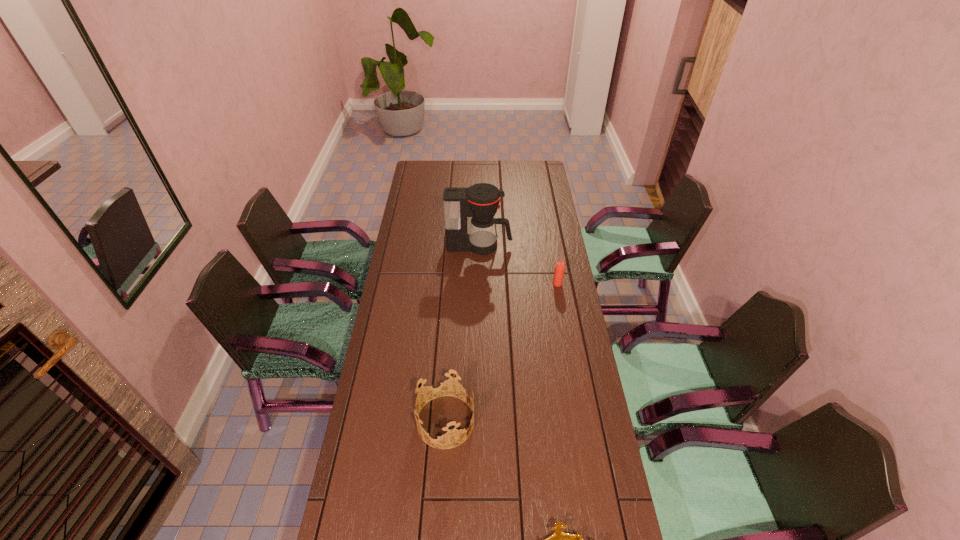
You are a GUI agent. You are given a task and a screenshot of the screen. Output one action in this format:
    pyautogui.click(x=<x>, y=<y>)
    Task: Click on the tallest object
    
    Given the screenshot: What is the action you would take?
    pyautogui.click(x=480, y=201)

Locate an element on the screen. The height and width of the screenshot is (540, 960). coffee maker is located at coordinates [480, 201].

Image resolution: width=960 pixels, height=540 pixels. Find the location of `the farther crown`. the farther crown is located at coordinates (442, 382).

Locate an element on the screen. This screenshot has height=540, width=960. the third farthest object is located at coordinates (442, 382).

Find the location of a particular element. the second farthest object is located at coordinates (559, 267).

Where is `free space located 0.090m pour from the carafe of the farthest object`? This screenshot has width=960, height=540. free space located 0.090m pour from the carafe of the farthest object is located at coordinates (532, 246).

You are a GUI agent. You are given a task and a screenshot of the screen. Output one action in this format:
    pyautogui.click(x=<x>, y=<y>)
    Task: Click on the vacant point located on the back of the farther crown
    The width and height of the screenshot is (960, 540).
    Given the screenshot: What is the action you would take?
    pyautogui.click(x=450, y=338)

Identify the location of vacant region located on the left of the Tabasco sauce. (473, 284).

Identify the location of object present at the right edge. The height and width of the screenshot is (540, 960). (559, 267).

Identify the location of free point at the far edge. This screenshot has height=540, width=960. (488, 177).